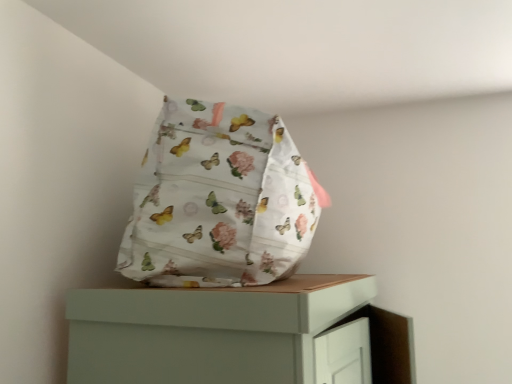
Describe the element at coordinates (220, 200) in the screenshot. The height and width of the screenshot is (384, 512). I see `floral fabric bag at upper center` at that location.

This screenshot has width=512, height=384. I want to click on floral fabric bag at upper center, so click(x=220, y=200).

This screenshot has height=384, width=512. What are the coordinates of `floral fabric bag at upper center` in the screenshot? It's located at pos(220,200).